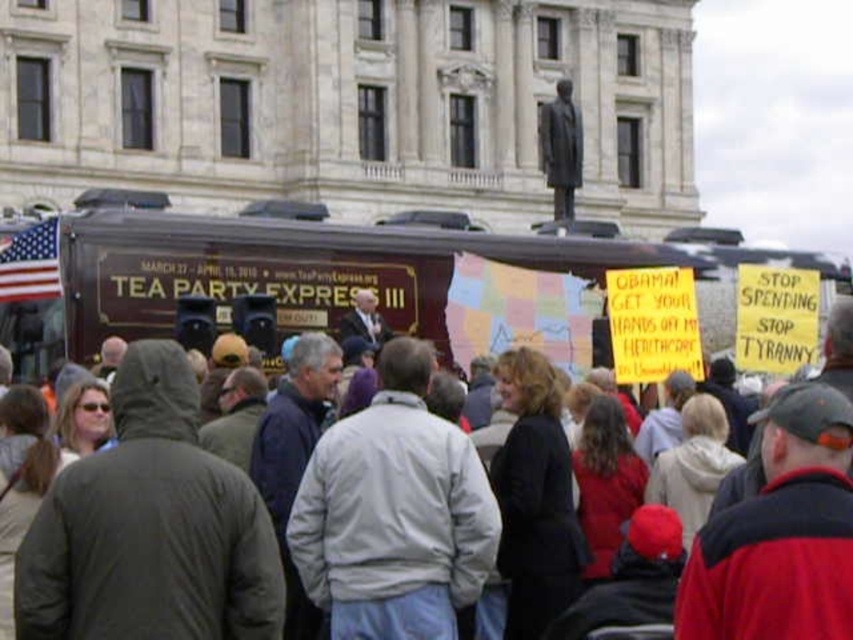
The image size is (853, 640). Find the location of `maroon polished wood tour bus at center`. maroon polished wood tour bus at center is located at coordinates point(294,268).

Is maroon polished wood tour bus at center taller than gray fabric jacket at center?

No.

This screenshot has height=640, width=853. Identify the location of maroon polished wood tour bus at center. (294, 268).

This screenshot has width=853, height=640. In order to click on maroon polished wood tour bus at center in this screenshot , I will do coord(294,268).

Is point (451, 464) closer to camera compared to point (741, 577)?

No, (451, 464) is further to viewer.

Consider the image. Can you confirm if gray fabric jacket at center is shorter than gray wool jacket at center?

Yes.

Where is `gray fabric jacket at center`? The height and width of the screenshot is (640, 853). gray fabric jacket at center is located at coordinates (393, 513).

Identify the location of gray fabric jacket at center. (393, 513).

Can you confirm if maroon polished wood tour bus at center is bigger than gray wool jacket at center?

Actually, maroon polished wood tour bus at center might be smaller than gray wool jacket at center.

Between maroon polished wood tour bus at center and gray wool jacket at center, which one has less height?

maroon polished wood tour bus at center is shorter.

The height and width of the screenshot is (640, 853). What are the coordinates of `maroon polished wood tour bus at center` in the screenshot? It's located at (294, 268).